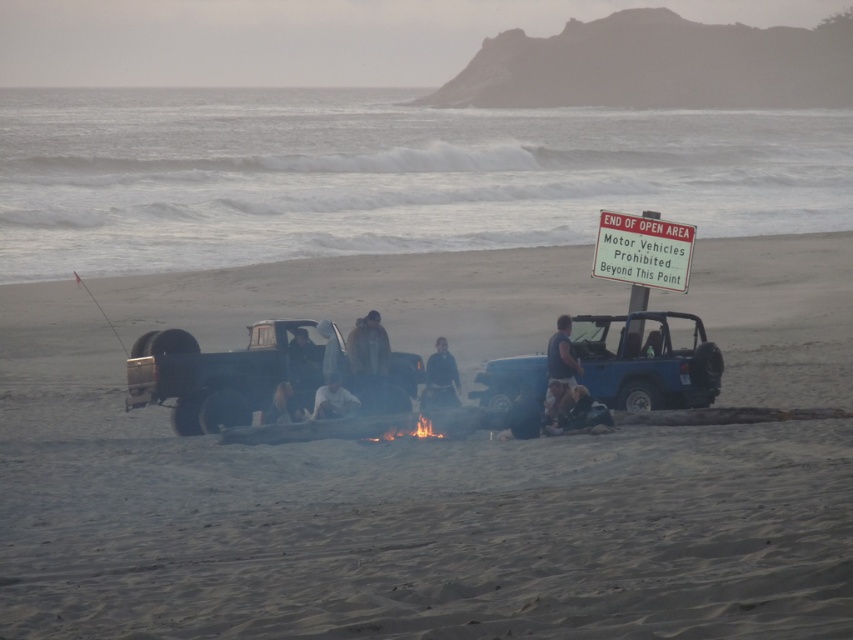
Which is below, white paper sign at upper right or dark blue jacket at center?

Positioned lower is dark blue jacket at center.

Who is taller, white paper sign at upper right or dark blue jacket at center?

white paper sign at upper right is taller.

Between point (682, 262) and point (436, 403), which one is positioned behind?

The point (682, 262) is more distant.

Find the location of `white paper sign at upper right`. white paper sign at upper right is located at coordinates (643, 250).

Who is shorter, dark blue jacket at center or smooth blue jeans at center?

With less height is smooth blue jeans at center.

Does dark blue jacket at center have a larger size compared to smooth blue jeans at center?

Yes, dark blue jacket at center is bigger than smooth blue jeans at center.

The width and height of the screenshot is (853, 640). Describe the element at coordinates (440, 378) in the screenshot. I see `dark blue jacket at center` at that location.

Where is `dark blue jacket at center`? dark blue jacket at center is located at coordinates (440, 378).

Who is higher up, dark blue jeans at center or flamewoodenbonfire at center?

Positioned higher is dark blue jeans at center.

Does dark blue jeans at center appear on the left side of flamewoodenbonfire at center?

In fact, dark blue jeans at center is to the right of flamewoodenbonfire at center.

Is point (584, 392) behind point (386, 436)?

No, it is not.

You are a GUI agent. You are given a task and a screenshot of the screen. Output one action in this format:
    pyautogui.click(x=<x>, y=<y>)
    Task: Click on the dark blue jeans at center
    
    Given the screenshot: What is the action you would take?
    pyautogui.click(x=573, y=410)